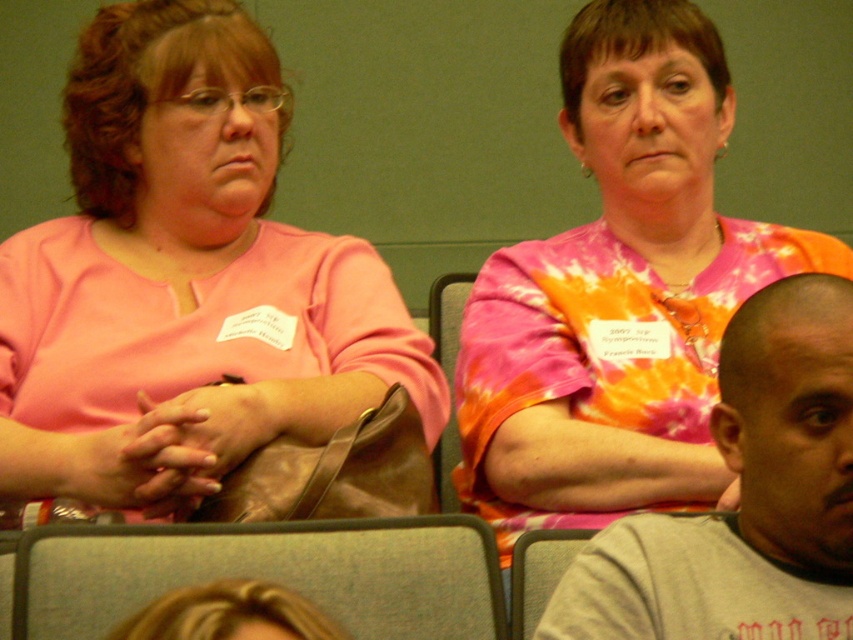
Question: Which is nearer to the pink fabric shirt at upper left?

Choices:
 (A) tie-dye fabric shirt at center
 (B) gray cotton shirt at lower right

Answer: (A)

Question: Which object is positioned farthest from the pink fabric shirt at upper left?

Choices:
 (A) tie-dye fabric shirt at center
 (B) gray cotton shirt at lower right

Answer: (B)

Question: Which object is farther from the camera taking this photo?

Choices:
 (A) gray cotton shirt at lower right
 (B) pink fabric shirt at upper left
 (C) tie-dye fabric shirt at center

Answer: (C)

Question: In this image, where is tie-dye fabric shirt at center located relative to gray cotton shirt at lower right?

Choices:
 (A) right
 (B) left

Answer: (B)

Question: Does tie-dye fabric shirt at center appear on the right side of gray cotton shirt at lower right?

Choices:
 (A) yes
 (B) no

Answer: (B)

Question: Is tie-dye fabric shirt at center wider than gray cotton shirt at lower right?

Choices:
 (A) yes
 (B) no

Answer: (A)